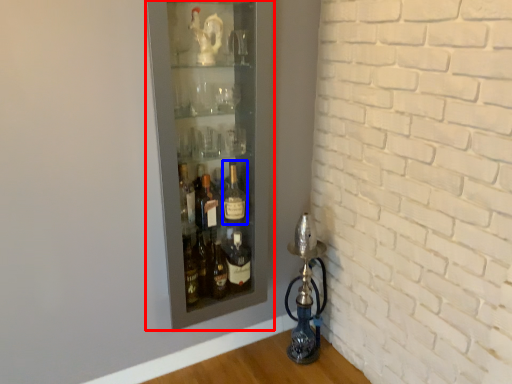
Question: Among these objects, which one is farthest to the camera, shelf (highlighted by a red box) or bottle (highlighted by a blue box)?

Choices:
 (A) shelf
 (B) bottle

Answer: (B)